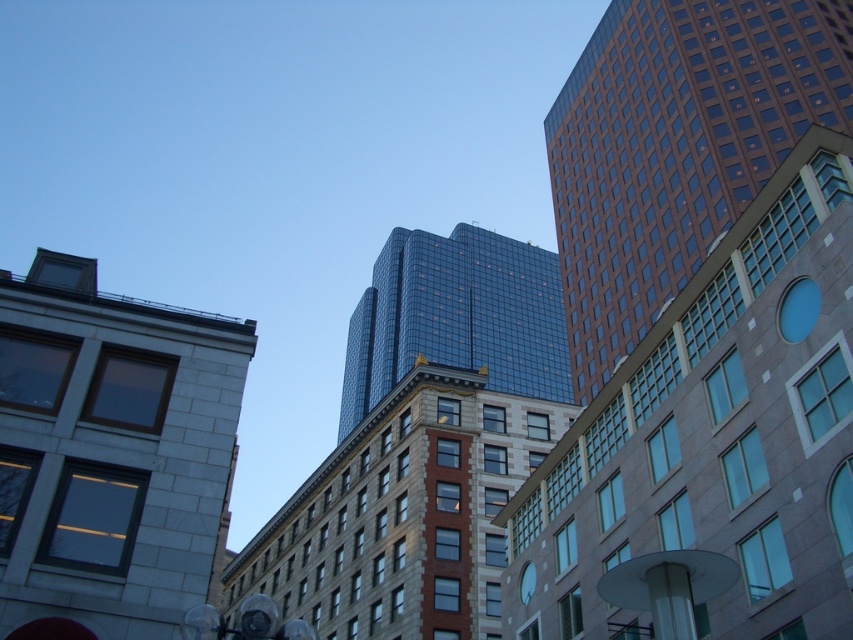
Question: Considering the real-world distances, which object is closest to the shiny glass building at center?

Choices:
 (A) glassy reflective building at center
 (B) gray stone building at upper left
 (C) blue glass clock at upper center

Answer: (A)

Question: From the image, what is the correct spatial relationship of brown glassy skyscraper at right in relation to blue glass clock at upper center?

Choices:
 (A) below
 (B) above

Answer: (B)

Question: Estimate the real-world distances between objects in this image. Which object is closer to the gray stone building at upper left?

Choices:
 (A) shiny glass building at center
 (B) blue glass clock at upper center
 (C) brown glassy skyscraper at right
 (D) glassy reflective building at center

Answer: (B)

Question: Which of the following is the farthest from the observer?

Choices:
 (A) brown glassy skyscraper at right
 (B) gray stone building at upper left

Answer: (A)

Question: Does brown glassy skyscraper at right have a smaller size compared to glassy reflective building at center?

Choices:
 (A) yes
 (B) no

Answer: (B)

Question: Does brown glassy skyscraper at right appear under glassy reflective building at center?

Choices:
 (A) no
 (B) yes

Answer: (A)